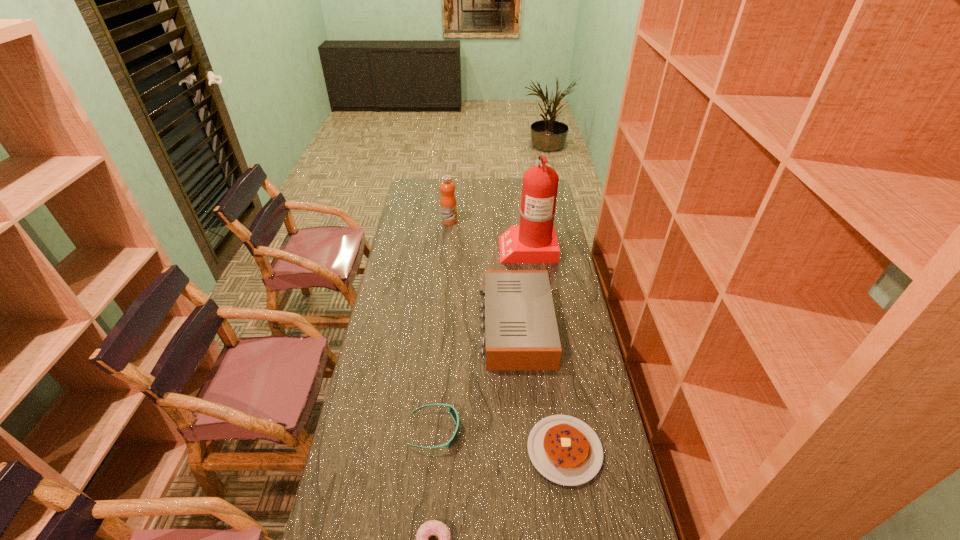
Where is `vacant area located on the front-facing side of the second farthest object`? Image resolution: width=960 pixels, height=540 pixels. vacant area located on the front-facing side of the second farthest object is located at coordinates (468, 247).

Find the location of `vacant region located 0.160m on the left of the fifth shortest object`. vacant region located 0.160m on the left of the fifth shortest object is located at coordinates (409, 221).

Where is `free space located on the front panel of the third tallest object`? This screenshot has height=540, width=960. free space located on the front panel of the third tallest object is located at coordinates (440, 326).

Locate an element on the screen. This screenshot has height=540, width=960. free space located on the front panel of the third tallest object is located at coordinates (429, 326).

Image resolution: width=960 pixels, height=540 pixels. In order to click on free space located 0.110m on the front panel of the third tallest object in this screenshot , I will do `click(450, 326)`.

Where is `vacant space located 0.370m on the front-facing side of the sunglasses`? The height and width of the screenshot is (540, 960). vacant space located 0.370m on the front-facing side of the sunglasses is located at coordinates (583, 431).

You are a GUI agent. You are given a task and a screenshot of the screen. Output one action in this format:
    pyautogui.click(x=<x>, y=<y>)
    Task: Click on the vacant point located 0.210m on the back of the pancake
    
    Given the screenshot: What is the action you would take?
    551,362

Find the location of a particular element. The image size is (960, 540). fire extinguisher that is at the right edge is located at coordinates (533, 241).

Identify the location of radio receiver at the right edge. This screenshot has width=960, height=540. (521, 333).

The height and width of the screenshot is (540, 960). In order to click on pancake present at the right edge in this screenshot , I will do `click(564, 449)`.